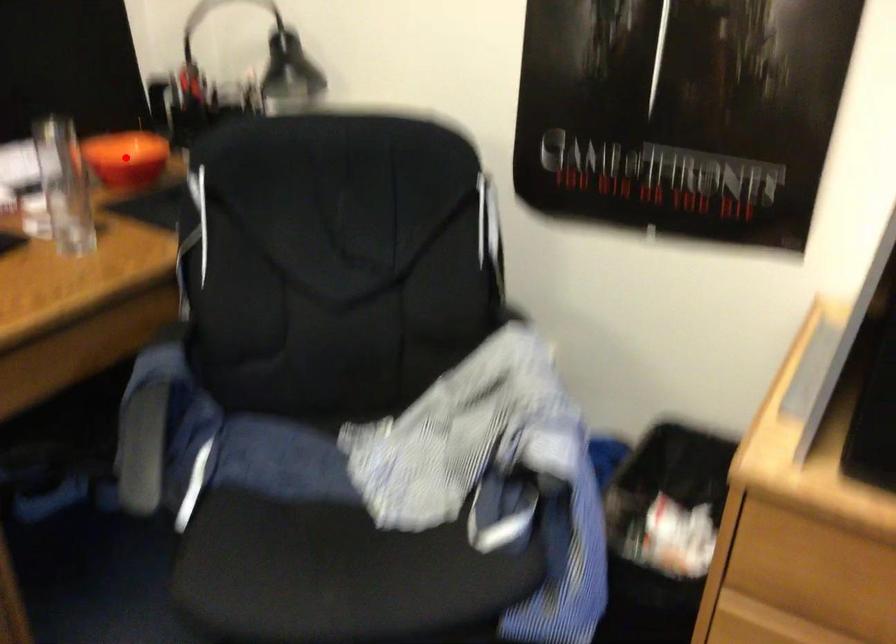
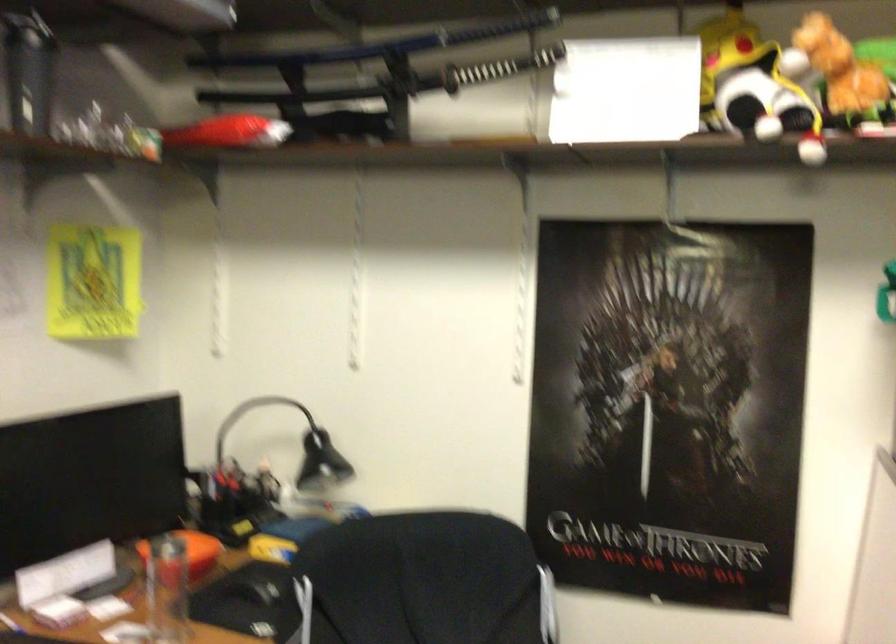
Question: I am providing you with two images of the same scene from different viewpoints. A red point is marked on the first image. Is the red point's position out of view in image 2?

Choices:
 (A) Yes
 (B) No

Answer: (A)